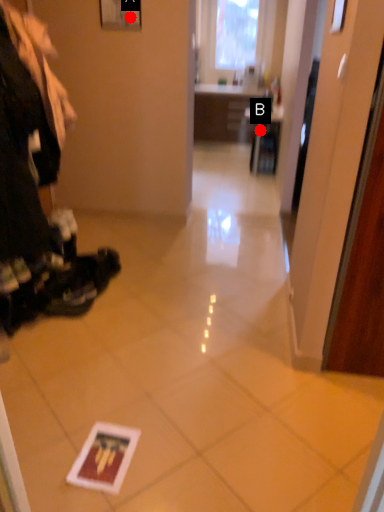
Question: Two points are circled on the image, labeled by A and B beside each circle. Among these points, which one is farthest from the camera?

Choices:
 (A) A is further
 (B) B is further

Answer: (B)